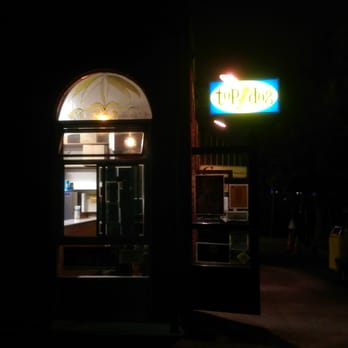
The image size is (348, 348). Find the location of `back kitchen area`. back kitchen area is located at coordinates (81, 188).